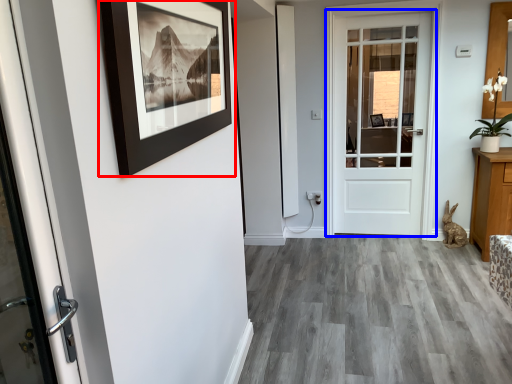
Question: Among these objects, which one is nearest to the camera, picture frame (highlighted by a red box) or door (highlighted by a blue box)?

Choices:
 (A) picture frame
 (B) door

Answer: (A)